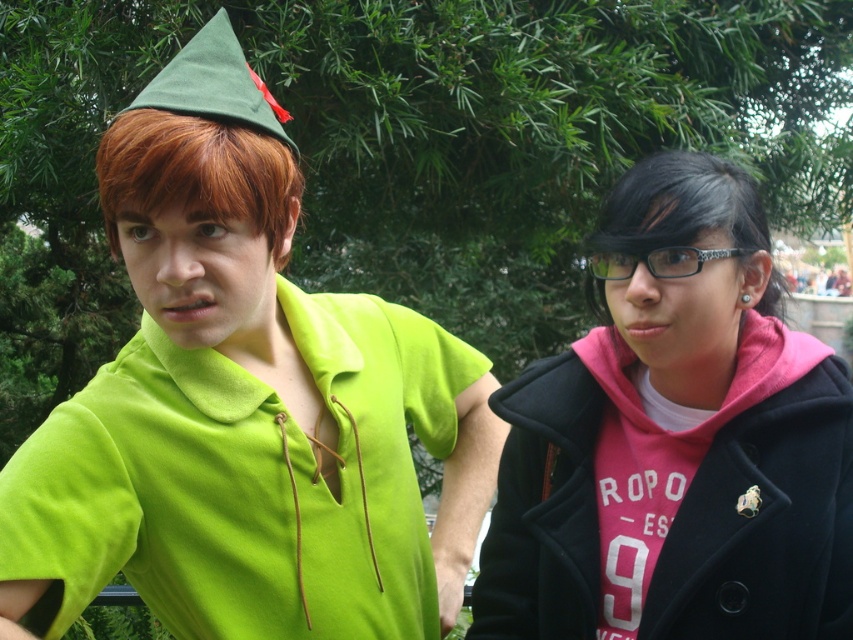
Question: Does pink fleece hoodie at right appear over reddish brown silky hair at left?

Choices:
 (A) yes
 (B) no

Answer: (B)

Question: Is pink fleece hoodie at right positioned before green felt party hat at upper center?

Choices:
 (A) yes
 (B) no

Answer: (B)

Question: Estimate the real-world distances between objects in this image. Which object is closer to the pink fleece hoodie at right?

Choices:
 (A) green felt party hat at upper center
 (B) reddish brown silky hair at left

Answer: (B)

Question: Among these points, which one is nearest to the camera?

Choices:
 (A) (126, 476)
 (B) (212, 35)
 (C) (141, 128)

Answer: (C)

Question: Among these objects, which one is nearest to the camera?

Choices:
 (A) matte green shirt at center
 (B) black shiny hair at right
 (C) green felt party hat at upper center

Answer: (A)

Question: Is matte green shirt at center to the left of green felt party hat at upper center from the viewer's perspective?

Choices:
 (A) no
 (B) yes

Answer: (A)